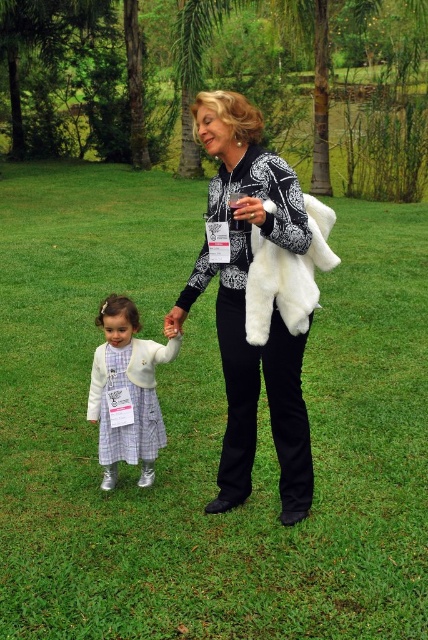
Question: Does plaid fabric dress at center appear over white fluffy fur coat at center?

Choices:
 (A) yes
 (B) no

Answer: (B)

Question: Can you confirm if white furry coat at center is positioned below white fluffy fur coat at center?

Choices:
 (A) yes
 (B) no

Answer: (B)

Question: Is white fur coat at center positioned in front of white fluffy fur coat at center?

Choices:
 (A) no
 (B) yes

Answer: (B)

Question: Which of the following is the farthest from the observer?

Choices:
 (A) (107, 317)
 (B) (246, 102)
 (C) (306, 275)

Answer: (A)

Question: Which point appears closest to the camera in this image?

Choices:
 (A) (139, 456)
 (B) (276, 237)

Answer: (B)

Question: Based on their relative distances, which object is nearer to the white fluffy fur coat at center?

Choices:
 (A) white furry coat at center
 (B) plaid fabric dress at center
 (C) white fur coat at center

Answer: (A)